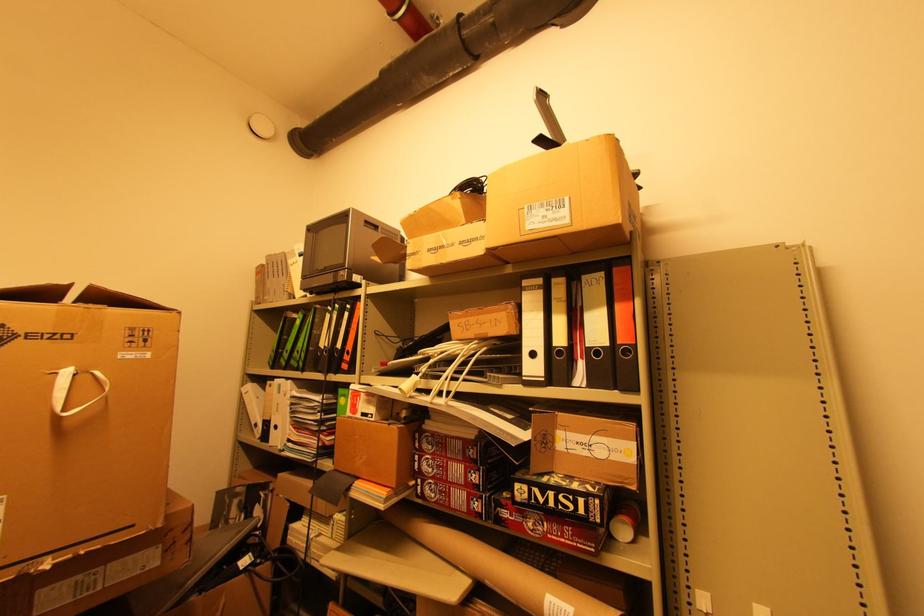
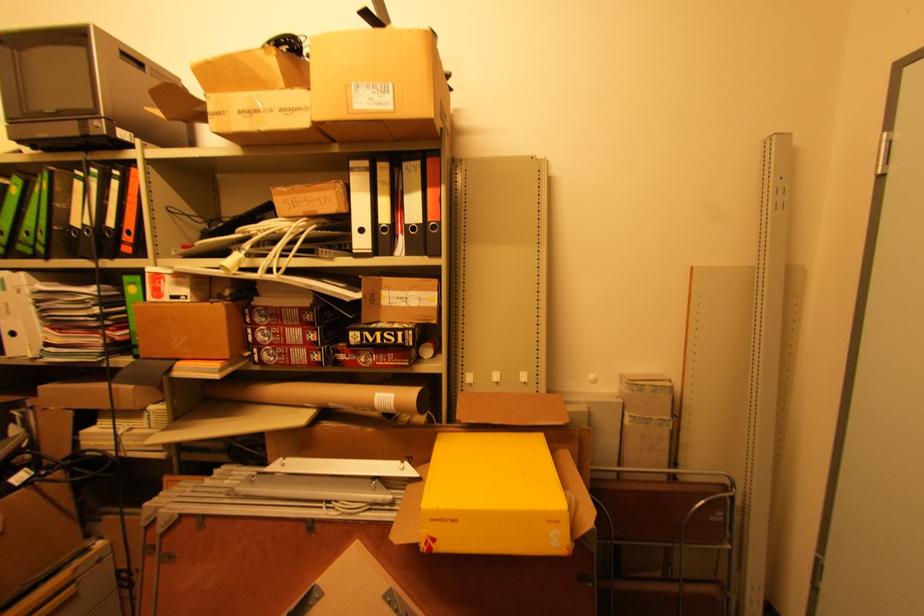
Locate, in the second image, the point that corresponds to point (537, 355) in the first image.

(365, 231)